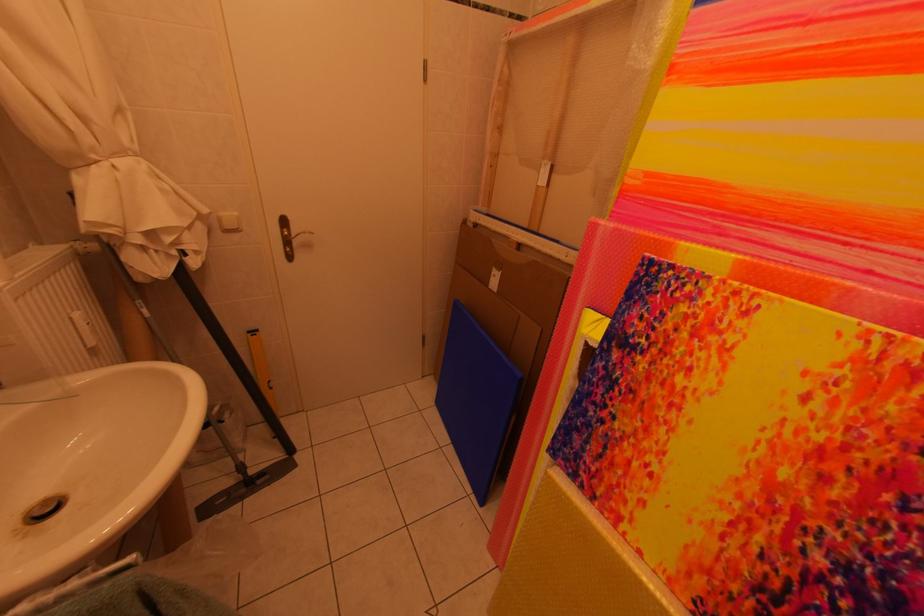
Where would you lift the black squeegee handle? Please return your answer as a coordinate pair (x, y).

(287, 237)